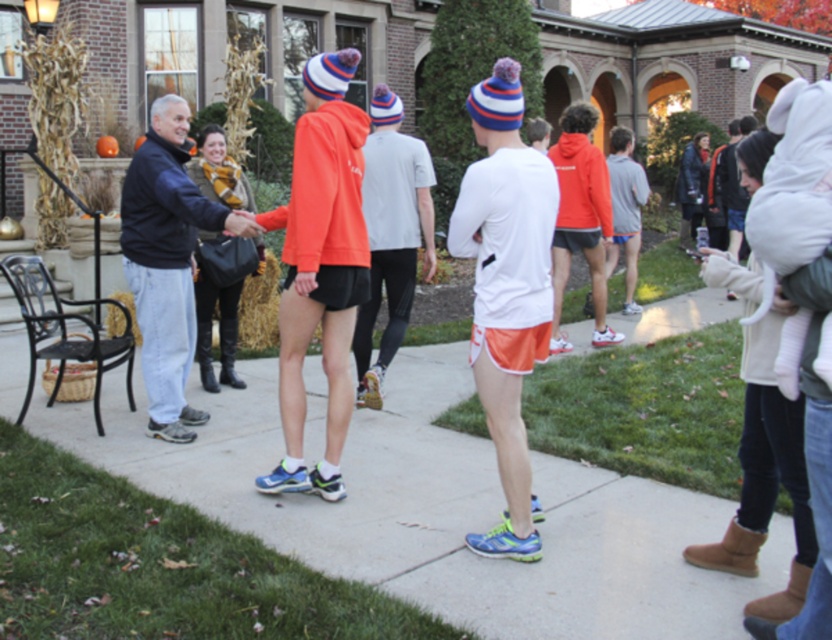
You are standing at the edge of the scene and want to walk towards the orange fleece sweatshirt at center. Which direction should you walk to avoid stepping on the concrete pavement at center?

Walk to the left of the orange fleece sweatshirt at center since the concrete pavement at center is to its right.